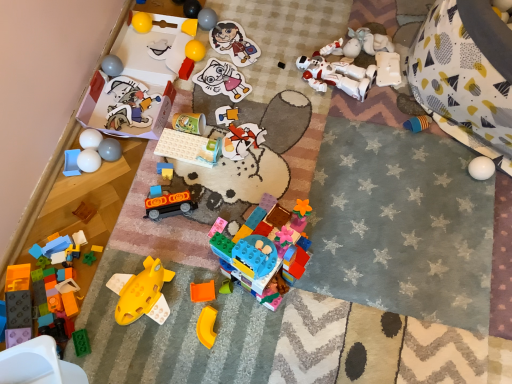
Find the location of `free area in between white matte robot at center, marked as the third toy in a right-to-left arrangement, and translucent orange plastic at center, arranged as the nineteenth toy when viewed from the left`. free area in between white matte robot at center, marked as the third toy in a right-to-left arrangement, and translucent orange plastic at center, arranged as the nineteenth toy when viewed from the left is located at coordinates (296, 148).